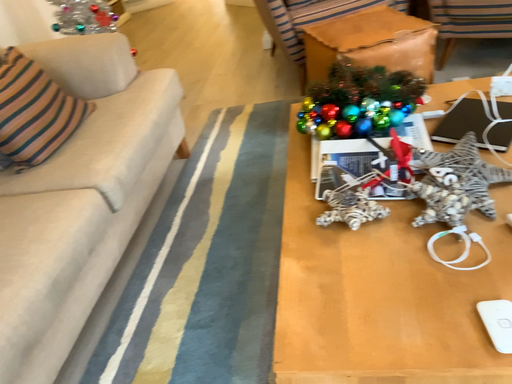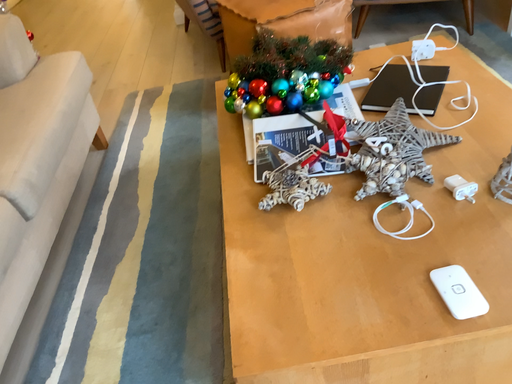
Question: Which way did the camera rotate in the video?

Choices:
 (A) rotated right
 (B) rotated left

Answer: (A)